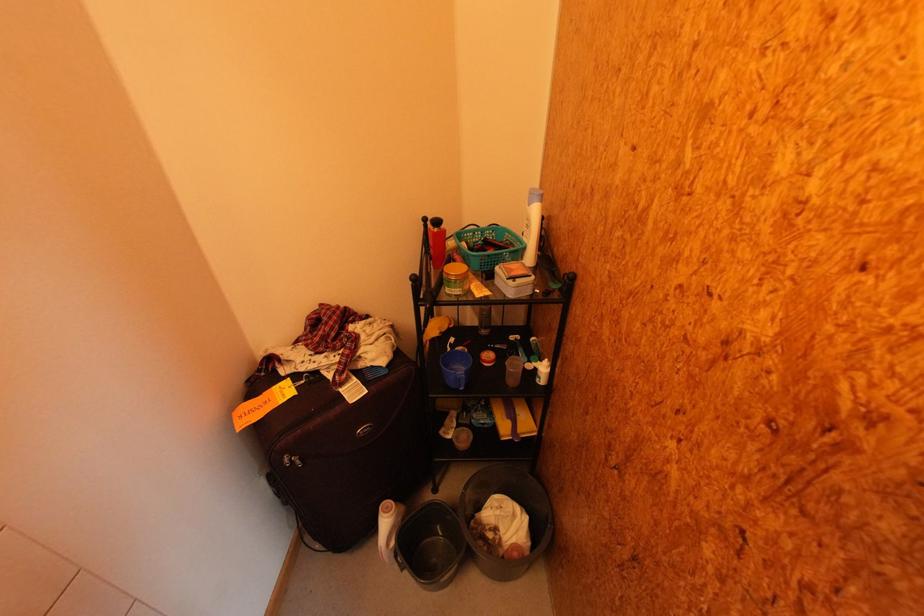
Where would you lift the turquoise basket handle? Please return your answer as a coordinate pair (x, y).

(488, 246)